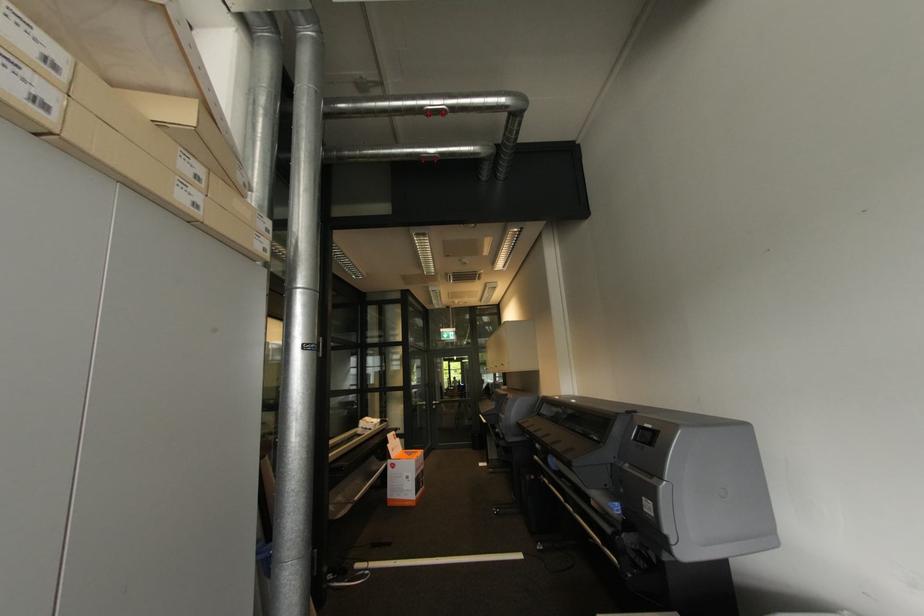
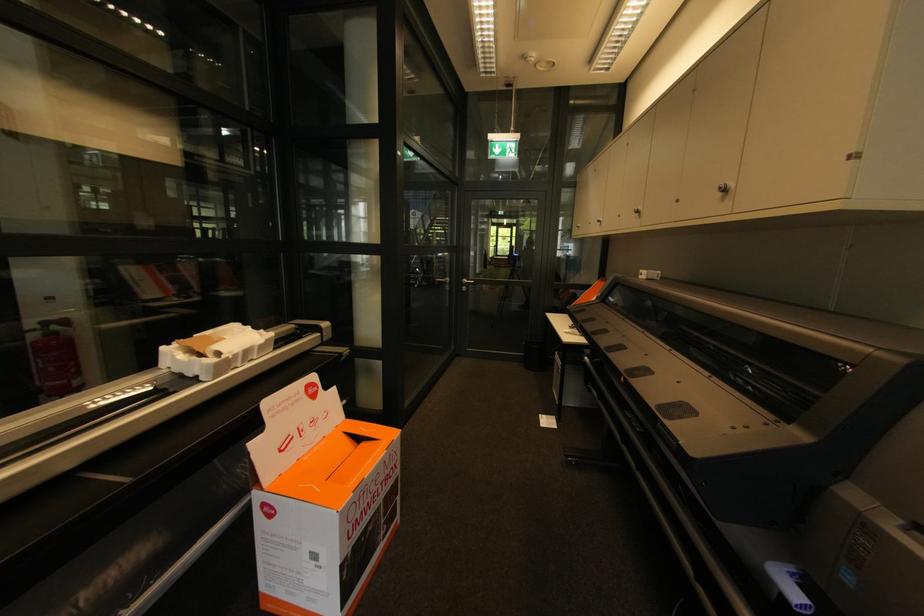
Locate, in the second image, the point that corresponds to (x=505, y=365) in the first image.

(727, 191)